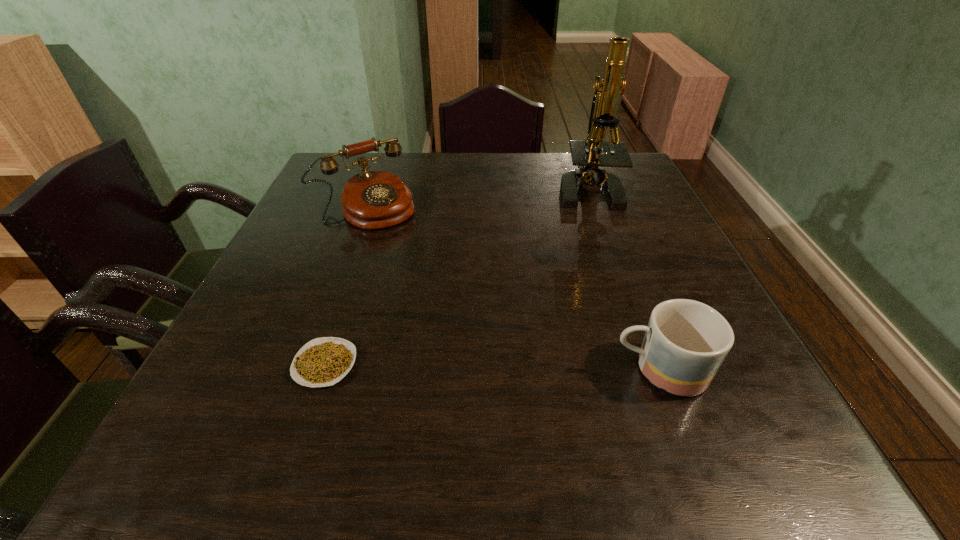
Find the location of a particular element. The width and height of the screenshot is (960, 540). mug that is at the right edge is located at coordinates (686, 341).

You are a GUI agent. You are given a task and a screenshot of the screen. Output one action in this format:
    pyautogui.click(x=<x>, y=<y>)
    Task: Click on the microscope that is at the right edge
    The height and width of the screenshot is (540, 960).
    Given the screenshot: What is the action you would take?
    pyautogui.click(x=586, y=154)

Identify the location of object located at the far left corner. Image resolution: width=960 pixels, height=540 pixels. (371, 200).

The height and width of the screenshot is (540, 960). What are the coordinates of `object that is at the near left corner` in the screenshot? It's located at (324, 361).

Identify the location of object located at the far right corner. (586, 154).

Image resolution: width=960 pixels, height=540 pixels. What are the coordinates of `object located in the near right corner section of the desktop` in the screenshot? It's located at (686, 341).

You are a GUI agent. You are given a task and a screenshot of the screen. Output one action in this format:
    pyautogui.click(x=<x>, y=<y>)
    Task: Click on the free space at the far edge of the desktop
    The width and height of the screenshot is (960, 540).
    Given the screenshot: What is the action you would take?
    pyautogui.click(x=531, y=178)

This screenshot has width=960, height=540. Identify the location of free location at the near edge. (364, 402).

Where is `vacant region at the left edge of the desktop`? The height and width of the screenshot is (540, 960). vacant region at the left edge of the desktop is located at coordinates (324, 196).

I want to click on free space at the right edge of the desktop, so click(x=594, y=192).